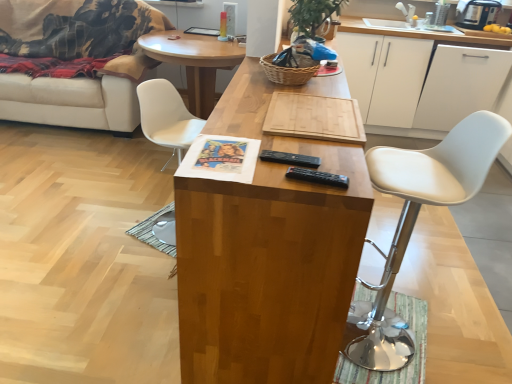
At what (x,y) coordinates should I click in order to perform the action: click on empty space that is ontop of wooden cutting board at center, positioned as the second coffee table in back-to-front order. Please return your answer as a coordinate pair (x, y). Looking at the image, I should click on (300, 107).